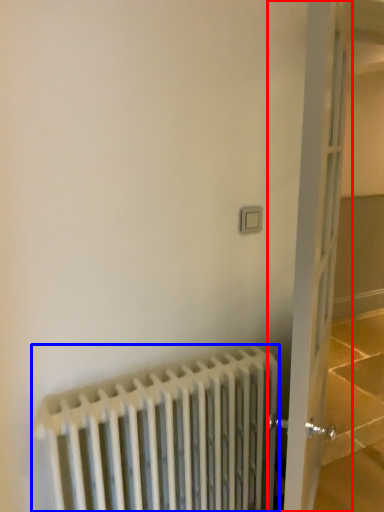
Question: Among these objects, which one is nearest to the camera, door (highlighted by a red box) or radiator (highlighted by a blue box)?

Choices:
 (A) door
 (B) radiator

Answer: (A)